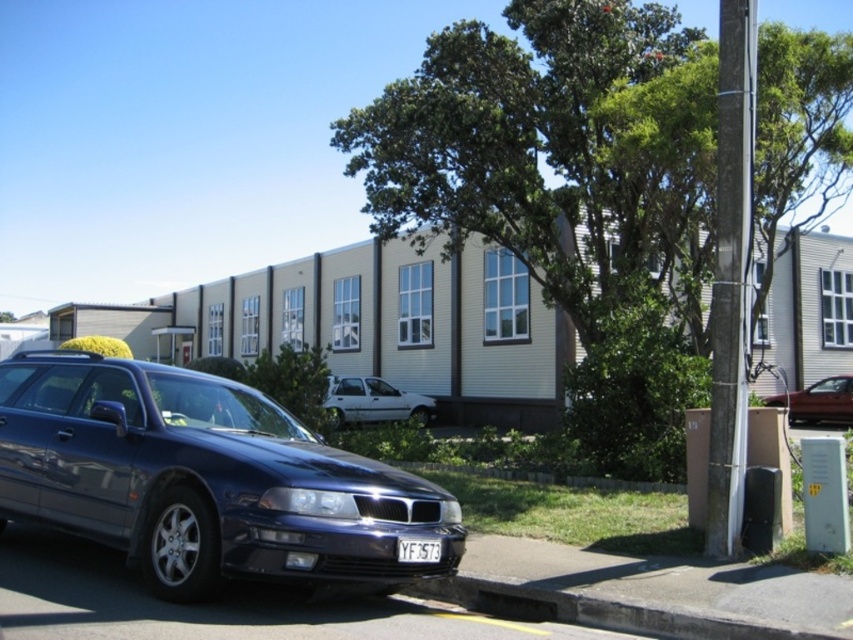
Does point (171, 600) lie behind point (775, 602)?

No, (171, 600) is closer to viewer.

Is glossy metallic station wagon at lower left positioned in front of black rubber curb at lower center?

Result: No, it is not.

Image resolution: width=853 pixels, height=640 pixels. Describe the element at coordinates (204, 480) in the screenshot. I see `glossy metallic station wagon at lower left` at that location.

Where is `glossy metallic station wagon at lower left`? The width and height of the screenshot is (853, 640). glossy metallic station wagon at lower left is located at coordinates (204, 480).

Is glossy metallic station wagon at lower left thinner than white plastic license plate at center?

In fact, glossy metallic station wagon at lower left might be wider than white plastic license plate at center.

Does point (180, 582) lie in front of point (410, 552)?

Yes.

This screenshot has width=853, height=640. What are the coordinates of `glossy metallic station wagon at lower left` in the screenshot? It's located at (204, 480).

Is green leafy tree at center closer to the viewer compared to black rubber curb at lower center?

No, green leafy tree at center is further to the viewer.

Does green leafy tree at center appear over black rubber curb at lower center?

Correct, green leafy tree at center is located above black rubber curb at lower center.

Is point (628, 205) farther from viewer compared to point (444, 584)?

Yes, point (628, 205) is behind point (444, 584).

The image size is (853, 640). I want to click on green leafy tree at center, so click(569, 189).